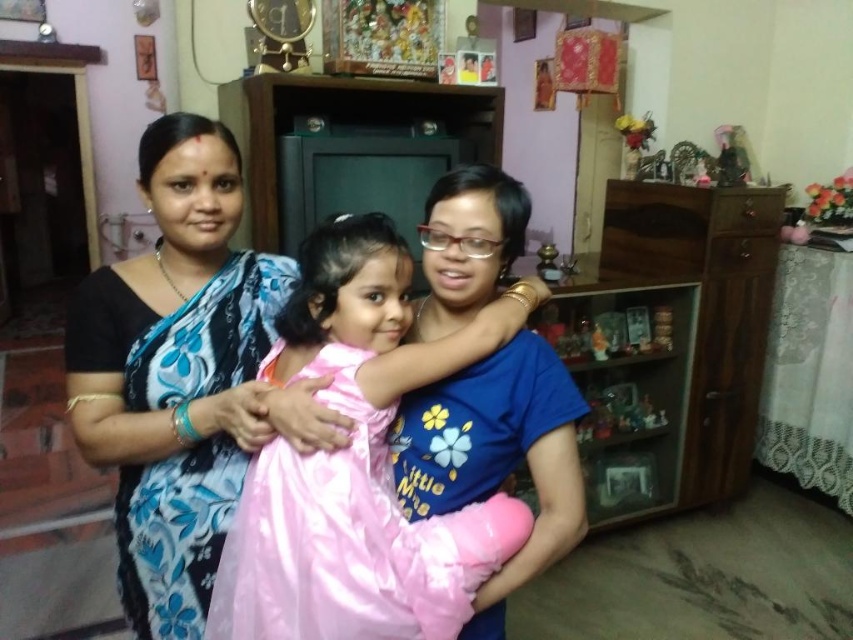
How distant is pink satin dress at center from blue floral saree at center?

The distance of pink satin dress at center from blue floral saree at center is 9.00 inches.

This screenshot has height=640, width=853. What are the coordinates of `pink satin dress at center` in the screenshot? It's located at (358, 465).

The width and height of the screenshot is (853, 640). In order to click on pink satin dress at center in this screenshot , I will do click(358, 465).